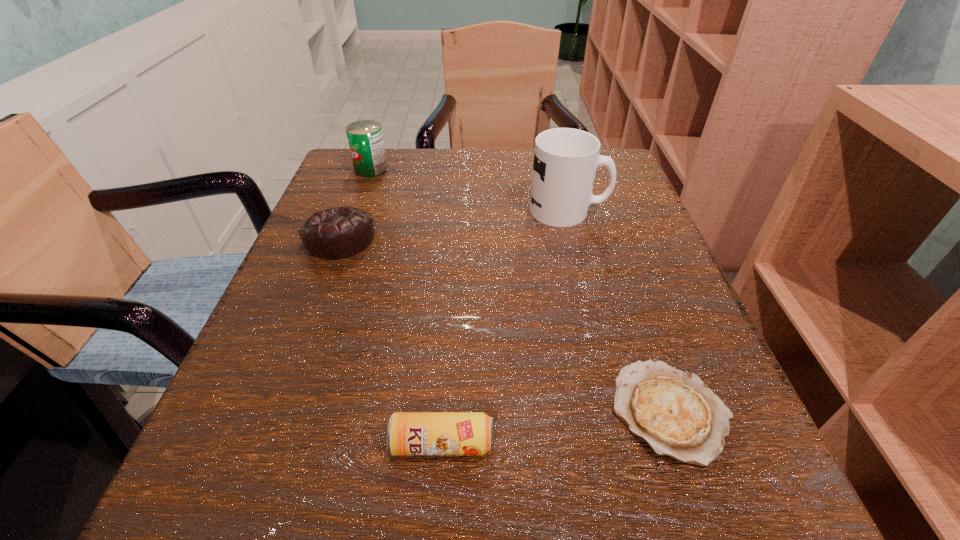
In order to click on vacant position located 0.360m on the back of the shortest object in this screenshot , I will do `click(602, 215)`.

What are the coordinates of `mug located in the far edge section of the desktop` in the screenshot? It's located at (565, 159).

The height and width of the screenshot is (540, 960). I want to click on can that is at the far edge, so click(365, 137).

The width and height of the screenshot is (960, 540). In order to click on beer can that is at the near edge in this screenshot , I will do `click(408, 433)`.

Where is `quiche located in the near edge section of the desktop`? Image resolution: width=960 pixels, height=540 pixels. quiche located in the near edge section of the desktop is located at coordinates (674, 412).

The image size is (960, 540). I want to click on can that is at the left edge, so click(365, 137).

At what (x,y) coordinates should I click in order to perform the action: click on beanbag located in the left edge section of the desktop. Please return your answer as a coordinate pair (x, y). The height and width of the screenshot is (540, 960). Looking at the image, I should click on (342, 232).

Where is `mug that is at the right edge`? The height and width of the screenshot is (540, 960). mug that is at the right edge is located at coordinates (565, 159).

The image size is (960, 540). Find the location of `quiche that is at the right edge`. quiche that is at the right edge is located at coordinates (674, 412).

Image resolution: width=960 pixels, height=540 pixels. Identify the location of object present at the far left corner. (365, 137).